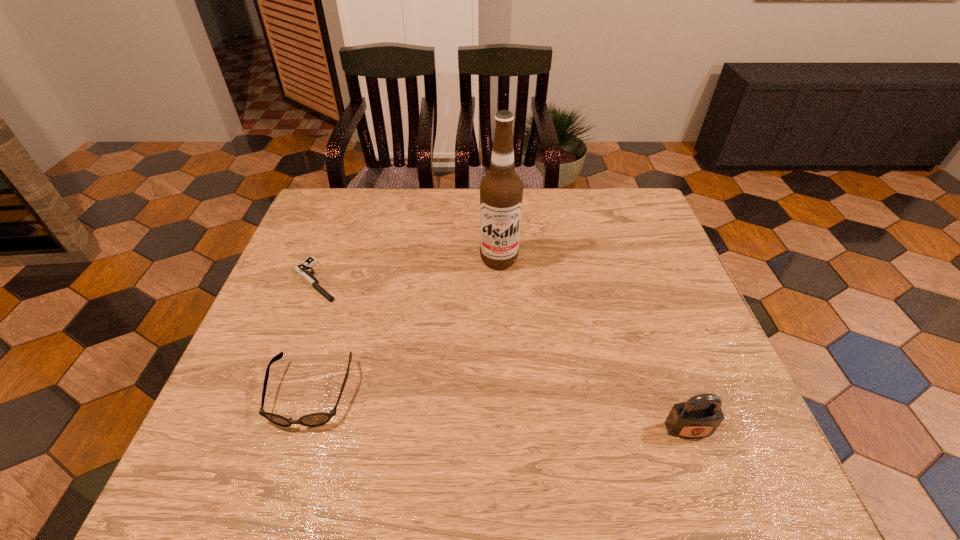
Find the location of a particular element. The width and height of the screenshot is (960, 540). free space located 0.150m on the front-facing side of the shortest object is located at coordinates (366, 326).

Identify the location of blank area located on the front-facing side of the shortest object. (368, 328).

Where is `sunglasses at the near edge`? sunglasses at the near edge is located at coordinates (314, 419).

Identify the location of padlock that is at the near edge. This screenshot has height=540, width=960. (700, 416).

Locate an element on the screen. The image size is (960, 540). sunglasses at the left edge is located at coordinates (314, 419).

Locate an element on the screen. This screenshot has width=960, height=540. pistol at the left edge is located at coordinates (302, 269).

This screenshot has height=540, width=960. In order to click on object located in the right edge section of the desktop in this screenshot , I will do `click(700, 416)`.

The height and width of the screenshot is (540, 960). I want to click on object present at the near left corner, so click(x=314, y=419).

At what (x,y) coordinates should I click in order to perform the action: click on object located in the near right corner section of the desktop. Please return your answer as a coordinate pair (x, y). This screenshot has width=960, height=540. Looking at the image, I should click on (700, 416).

In the image, there is a desktop. Find the location of `vacant space at the far edge`. vacant space at the far edge is located at coordinates (426, 200).